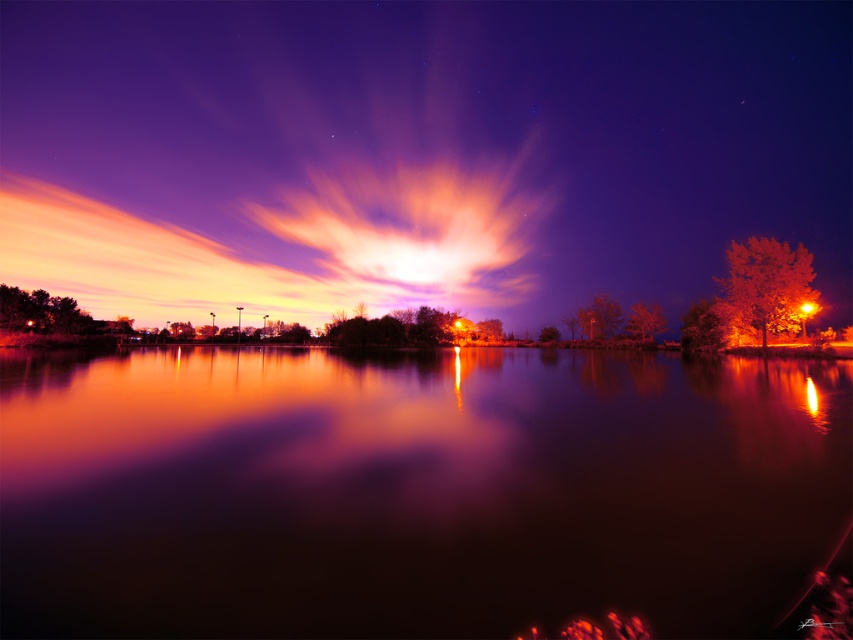
You are an artist trying to paint the scene. You notice the glossy reflective water at center and the radiant orange cloud at center. Which object in the scene is lower in height?

The glossy reflective water at center has a lesser height compared to the radiant orange cloud at center, so the glossy reflective water at center is lower in height.

In the scene shown: You are an artist planning to paint the scene. You want to ensure the glossy reflective water at center and the radiant orange cloud at center are proportionally accurate. Which object should you paint to be wider?

The radiant orange cloud at center should be painted wider since it has a greater width than the glossy reflective water at center according to the description.

You are standing on the edge of the lake and want to reach a specific point in the water marked as point (386, 356). If your swimming range is 50 meters, can you safely swim to that point?

The distance between you and point (386, 356) is 74.97 meters, which exceeds your swimming range of 50 meters. You cannot safely swim to that point.